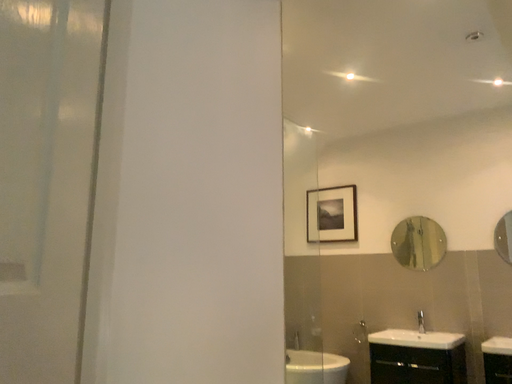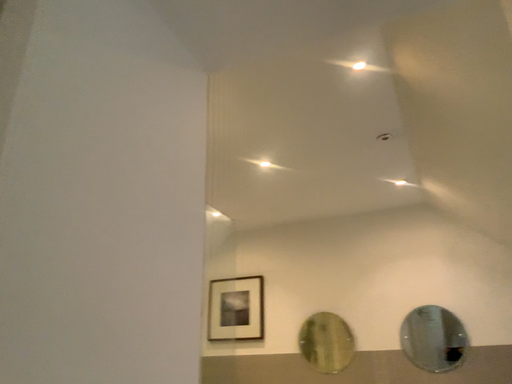
Question: How did the camera likely rotate when shooting the video?

Choices:
 (A) rotated left
 (B) rotated right

Answer: (B)